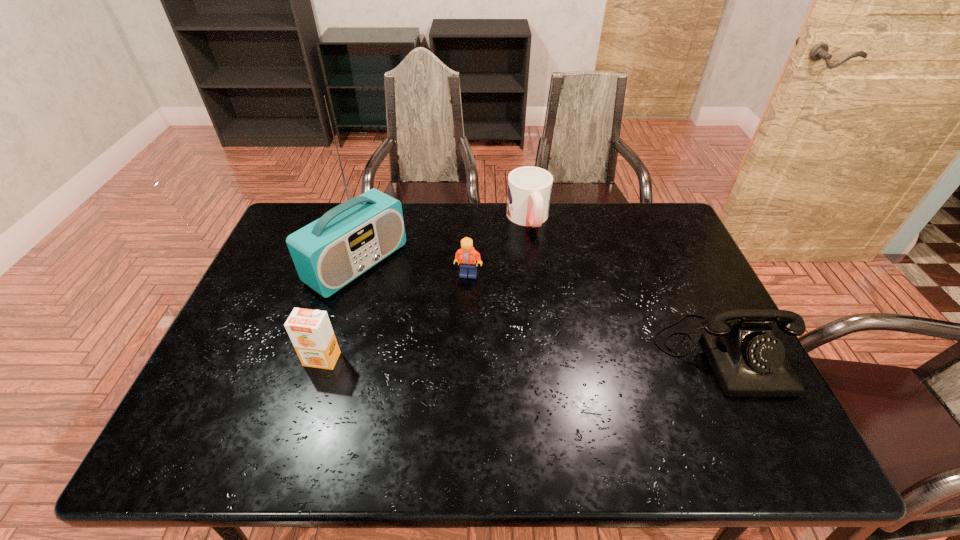
The image size is (960, 540). Find the location of `orange juice`. orange juice is located at coordinates coord(311,333).

This screenshot has height=540, width=960. Find the location of `the rightmost object`. the rightmost object is located at coordinates (748, 361).

What are the coordinates of `the tallest object` in the screenshot? It's located at (349, 239).

You are a GUI agent. You are given a task and a screenshot of the screen. Output one action in this format:
    pyautogui.click(x=<x>, y=<y>)
    Task: Click on the third object from left to right
    The image size is (960, 540).
    Given the screenshot: What is the action you would take?
    pyautogui.click(x=467, y=256)

Find the location of a particular element. This screenshot has height=540, width=960. the fourth object from left to right is located at coordinates (529, 191).

You are a GUI agent. You are given a task and a screenshot of the screen. Output one action in this format:
    pyautogui.click(x=<x>, y=<y>)
    Task: Click on the vacant space located 0.170m on the left of the orange juice
    The height and width of the screenshot is (540, 960).
    Given the screenshot: What is the action you would take?
    pyautogui.click(x=237, y=359)

Locate an element on the screen. vacant space located 0.340m on the front panel of the radio receiver is located at coordinates (480, 346).

This screenshot has height=540, width=960. In order to click on vacant space located on the front panel of the radio receiver in this screenshot , I will do `click(426, 311)`.

Locate an element on the screen. The image size is (960, 540). vacant area located 0.400m on the front panel of the radio receiver is located at coordinates (498, 357).

Image resolution: width=960 pixels, height=540 pixels. Find the location of `blank area located on the front-facing side of the Lego`. blank area located on the front-facing side of the Lego is located at coordinates (499, 374).